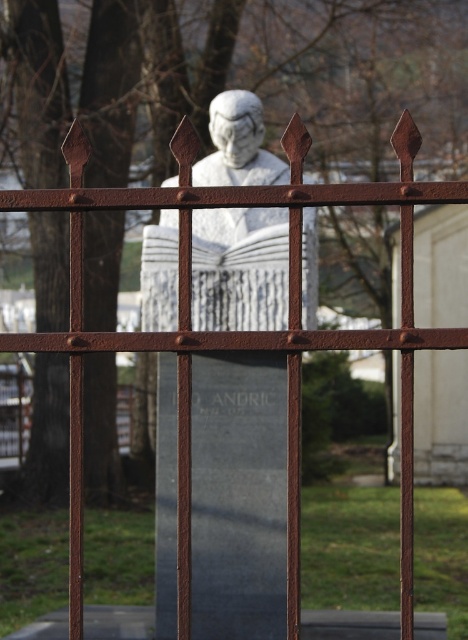
Question: Among these objects, which one is farthest from the camera?

Choices:
 (A) white marble bust at center
 (B) white marble statue at center

Answer: (B)

Question: Does white marble bust at center appear over white marble statue at center?

Choices:
 (A) no
 (B) yes

Answer: (A)

Question: Is white marble bust at center further to the viewer compared to white marble statue at center?

Choices:
 (A) no
 (B) yes

Answer: (A)

Question: Which point is closer to the camera?

Choices:
 (A) (247, 234)
 (B) (302, 250)

Answer: (B)

Question: Which object is closer to the camera taking this photo?

Choices:
 (A) white marble statue at center
 (B) white marble bust at center

Answer: (B)

Question: Does white marble bust at center appear on the right side of white marble statue at center?

Choices:
 (A) no
 (B) yes

Answer: (A)